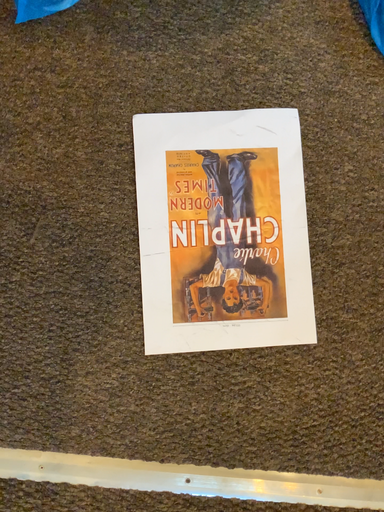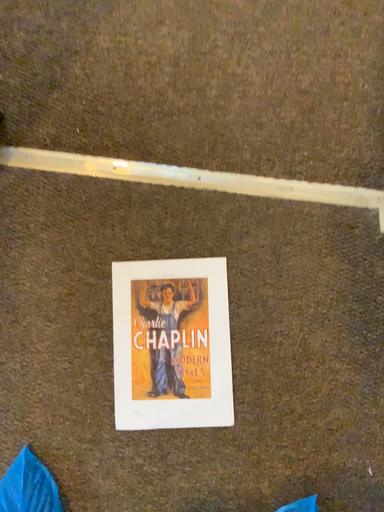
Question: Which way did the camera rotate in the video?

Choices:
 (A) rotated downward
 (B) rotated upward

Answer: (B)